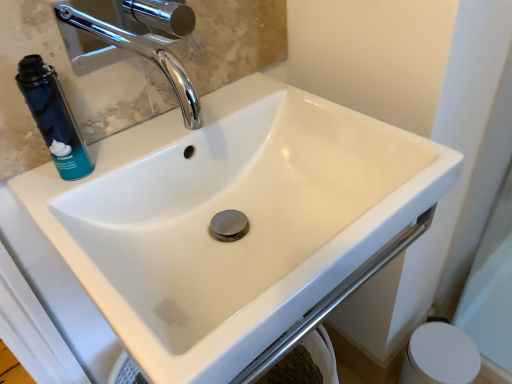
Question: Is blue matte can at upper left wider or thinner than white matte toilet paper at lower right?

Choices:
 (A) thin
 (B) wide

Answer: (A)

Question: Would you say blue matte can at upper left is to the left or to the right of white matte toilet paper at lower right in the picture?

Choices:
 (A) right
 (B) left

Answer: (B)

Question: Which object is positioned farthest from the blue matte can at upper left?

Choices:
 (A) matte glass mirror at upper left
 (B) white matte toilet paper at lower right

Answer: (B)

Question: Considering the real-world distances, which object is closest to the matte glass mirror at upper left?

Choices:
 (A) blue matte can at upper left
 (B) white matte toilet paper at lower right

Answer: (A)